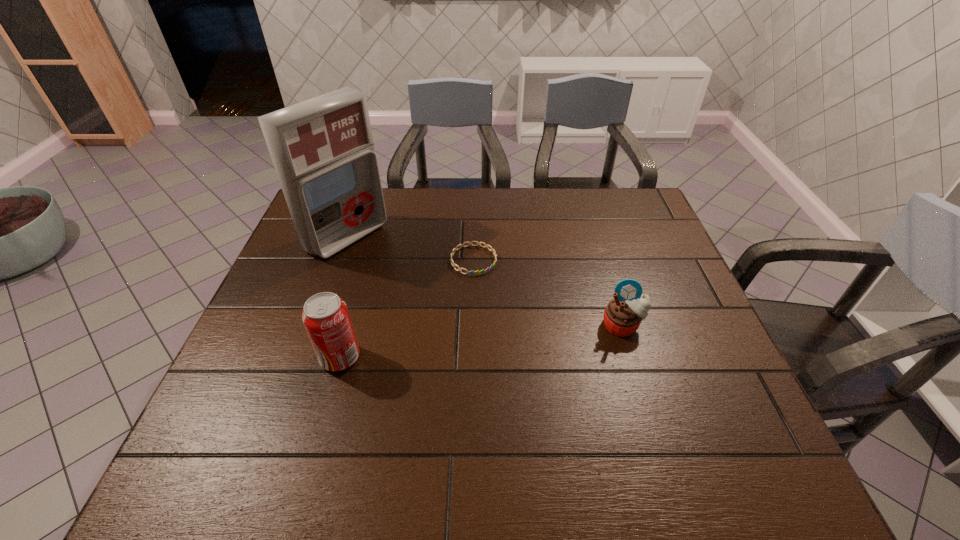
The height and width of the screenshot is (540, 960). I want to click on free space on the desktop that is between the soda can and the second shortest object and is positioned on the front-facing side of the first-aid kit, so click(509, 339).

What are the coordinates of `vacant space on the desktop that is between the soda can and the second shortest object and is positioned on the surface of the shortest object showing star-shaped elements` in the screenshot? It's located at (528, 336).